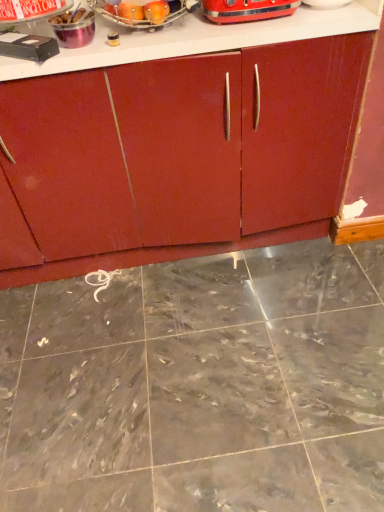
Locate an element on the screen. vacant region under gray marble floor at center (from a real-world perspective) is located at coordinates (187, 381).